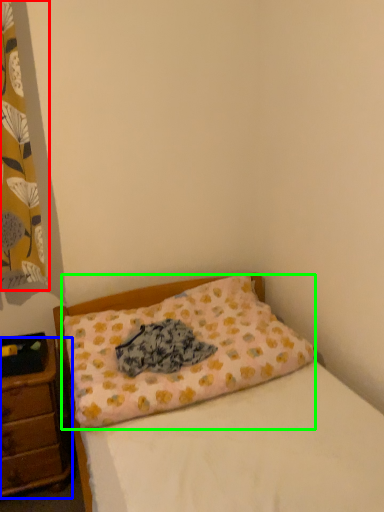
Question: Which object is the closest to the curtain (highlighted by a red box)? Choose among these: nightstand (highlighted by a blue box) or pillow (highlighted by a green box).

Choices:
 (A) nightstand
 (B) pillow

Answer: (B)